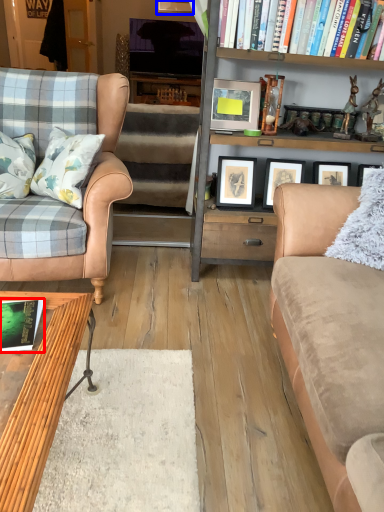
Question: Which point is closer to the camera, book (highlighted by a red box) or picture frame (highlighted by a blue box)?

Choices:
 (A) book
 (B) picture frame

Answer: (A)